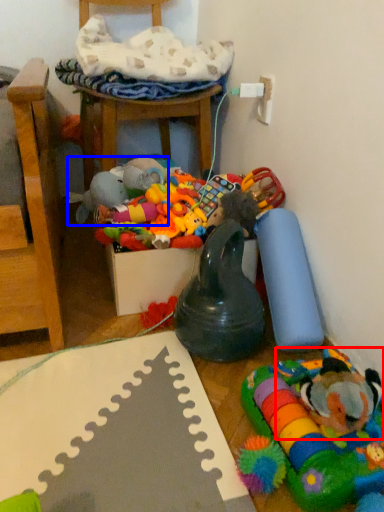
Question: Which of the following is the closest to the observer, toy (highlighted by a red box) or toy (highlighted by a blue box)?

Choices:
 (A) toy
 (B) toy

Answer: (A)